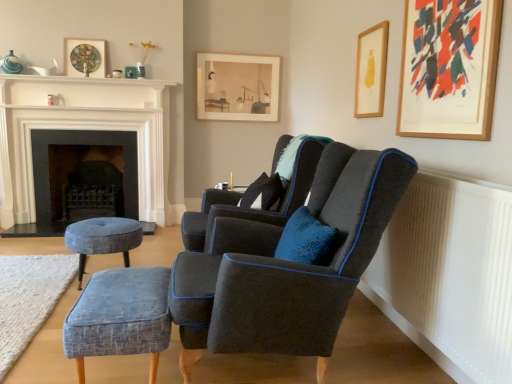
The width and height of the screenshot is (512, 384). I want to click on textured blue ottoman at lower left, so click(29, 298).

Measure the distance between matte glass picture frame at upper left, which is counted as the first picture frame, starting from the left, and camera.

matte glass picture frame at upper left, which is counted as the first picture frame, starting from the left, is 3.98 meters from camera.

You are a GUI agent. You are given a task and a screenshot of the screen. Output one action in this format:
    pyautogui.click(x=<x>, y=<y>)
    Task: Click on the white glossy fireplace at upper left, the first fireplace positioned from the front
    
    Given the screenshot: What is the action you would take?
    pyautogui.click(x=85, y=129)

Image resolution: width=512 pixels, height=384 pixels. Find the location of `textured blue ottoman at lower left`. textured blue ottoman at lower left is located at coordinates (29, 298).

From the image's perspective, which one is positioned lower, textured blue ottoman at lower left or velvet dark blue armchair at center, the first chair positioned from the back?

textured blue ottoman at lower left, from the image's perspective.

From a real-world perspective, is textured blue ottoman at lower left below velvet dark blue armchair at center, the first chair positioned from the back?

Yes.

Does textured blue ottoman at lower left appear on the left side of velvet dark blue armchair at center, the first chair positioned from the back?

Yes, textured blue ottoman at lower left is to the left of velvet dark blue armchair at center, the first chair positioned from the back.

From a real-world perspective, is matte glass picture frame at upper left, the third picture frame when ordered from front to back, below velvet blue stool at lower left, arranged as the 2th stool when viewed from the right?

Incorrect, from a real-world perspective, matte glass picture frame at upper left, the third picture frame when ordered from front to back, is higher than velvet blue stool at lower left, arranged as the 2th stool when viewed from the right.

Based on the photo, does matte glass picture frame at upper left, the fourth picture frame viewed from the right, have a larger size compared to velvet blue stool at lower left, marked as the first stool in a back-to-front arrangement?

No.

In the scene shown: Is matte glass picture frame at upper left, which is counted as the first picture frame, starting from the left, with velvet blue stool at lower left, arranged as the 2th stool when viewed from the right?

matte glass picture frame at upper left, which is counted as the first picture frame, starting from the left, and velvet blue stool at lower left, arranged as the 2th stool when viewed from the right, are clearly separated.

Is the position of matte glass picture frame at upper left, the fourth picture frame viewed from the right, more distant than that of velvet blue stool at lower left, which ranks as the 2th stool in front-to-back order?

Yes, matte glass picture frame at upper left, the fourth picture frame viewed from the right, is further from the camera.

Are dark gray stone fireplace at left, placed as the 1th fireplace when sorted from back to front, and wooden picture frame at upper right, placed as the 3th picture frame when sorted from back to front, far apart?

That's right, there is a large distance between dark gray stone fireplace at left, placed as the 1th fireplace when sorted from back to front, and wooden picture frame at upper right, placed as the 3th picture frame when sorted from back to front.

Considering the points (67, 135) and (381, 27), which point is in front, point (67, 135) or point (381, 27)?

The point (381, 27) is closer to the camera.

From a real-world perspective, is dark gray stone fireplace at left, placed as the 1th fireplace when sorted from back to front, positioned above or below wooden picture frame at upper right, the 2th picture frame from the right?

In terms of real-world spatial position, dark gray stone fireplace at left, placed as the 1th fireplace when sorted from back to front, is below wooden picture frame at upper right, the 2th picture frame from the right.

Is dark gray stone fireplace at left, the 2th fireplace when ordered from front to back, wider than wooden picture frame at upper right, placed as the 3th picture frame when sorted from back to front?

Yes, dark gray stone fireplace at left, the 2th fireplace when ordered from front to back, is wider than wooden picture frame at upper right, placed as the 3th picture frame when sorted from back to front.

Are velvet dark blue armchair at center, the first chair positioned from the back, and matte glass picture frame at upper left, which is counted as the first picture frame, starting from the left, far apart?

That's right, there is a large distance between velvet dark blue armchair at center, the first chair positioned from the back, and matte glass picture frame at upper left, which is counted as the first picture frame, starting from the left.

From a real-world perspective, which object rests below the other?

From a 3D spatial view, velvet dark blue armchair at center, the first chair positioned from the back, is below.

Is velvet dark blue armchair at center, the first chair positioned from the back, behind matte glass picture frame at upper left, acting as the second picture frame starting from the back?

No, velvet dark blue armchair at center, the first chair positioned from the back, is closer to the viewer.

Is velvet dark blue armchair at center, the first chair positioned from the back, completely or partially outside of matte glass picture frame at upper left, the third picture frame when ordered from front to back?

Yes, velvet dark blue armchair at center, the first chair positioned from the back, is not within matte glass picture frame at upper left, the third picture frame when ordered from front to back.

Is wooden framed artwork at upper right, positioned as the first picture frame in front-to-back order, completely or partially outside of dark blue fabric chair at right, the second chair in the back-to-front sequence?

Yes.

Consider the image. Can you confirm if wooden framed artwork at upper right, positioned as the first picture frame in front-to-back order, is positioned to the right of dark blue fabric chair at right, the second chair in the back-to-front sequence?

Correct, you'll find wooden framed artwork at upper right, positioned as the first picture frame in front-to-back order, to the right of dark blue fabric chair at right, the second chair in the back-to-front sequence.

From a real-world perspective, is wooden framed artwork at upper right, positioned as the first picture frame in front-to-back order, below dark blue fabric chair at right, the second chair in the back-to-front sequence?

No.

Does wooden framed artwork at upper right, the 4th picture frame positioned from the back, lie behind dark blue fabric chair at right, the first chair when ordered from front to back?

Yes, it is behind dark blue fabric chair at right, the first chair when ordered from front to back.

Where is `picture frame that is the 1st one when counting forward from the matte glass picture frame at upper left, the third picture frame when ordered from front to back`? picture frame that is the 1st one when counting forward from the matte glass picture frame at upper left, the third picture frame when ordered from front to back is located at coordinates (371, 71).

Which of these two, wooden picture frame at upper right, which ranks as the second picture frame in front-to-back order, or matte glass picture frame at upper left, the fourth picture frame viewed from the right, stands taller?

Standing taller between the two is wooden picture frame at upper right, which ranks as the second picture frame in front-to-back order.

Considering the positions of points (373, 97) and (101, 74), is point (373, 97) closer to camera compared to point (101, 74)?

Yes, it is.

Can we say wooden picture frame at upper right, placed as the 3th picture frame when sorted from back to front, lies outside matte glass picture frame at upper left, the fourth picture frame viewed from the right?

Absolutely, wooden picture frame at upper right, placed as the 3th picture frame when sorted from back to front, is external to matte glass picture frame at upper left, the fourth picture frame viewed from the right.

Does velvet blue stool at lower left, which ranks as the 2th stool in front-to-back order, turn towards textured blue fabric stool at lower left, the first stool viewed from the front?

No, velvet blue stool at lower left, which ranks as the 2th stool in front-to-back order, is not oriented towards textured blue fabric stool at lower left, the first stool viewed from the front.

From a real-world perspective, between velvet blue stool at lower left, marked as the first stool in a back-to-front arrangement, and textured blue fabric stool at lower left, acting as the first stool starting from the right, who is vertically higher?

From a 3D spatial view, velvet blue stool at lower left, marked as the first stool in a back-to-front arrangement, is above.

Find the location of a particular element. The width and height of the screenshot is (512, 384). stool above the textured blue fabric stool at lower left, positioned as the second stool in left-to-right order (from the image's perspective) is located at coordinates (102, 239).

Where is `plain on the left side of velvet dark blue armchair at center, which is the 2th chair in front-to-back order`? Image resolution: width=512 pixels, height=384 pixels. plain on the left side of velvet dark blue armchair at center, which is the 2th chair in front-to-back order is located at coordinates (29, 298).

From the velvet blue stool at lower left, arranged as the 2th stool when viewed from the right, count 1st picture frames backward and point to it. Please provide its 2D coordinates.

[(84, 57)]

Estimate the real-world distances between objects in this image. Which object is closer to wooden picture frame at upper right, the 2th picture frame from the right, textured blue ottoman at lower left or textured blue fabric stool at lower left, positioned as the second stool in left-to-right order?

textured blue fabric stool at lower left, positioned as the second stool in left-to-right order.

From the image, which object appears to be nearer to matte glass picture frame at upper left, acting as the second picture frame starting from the back, velvet blue stool at lower left, arranged as the 2th stool when viewed from the right, or dark gray stone fireplace at left, the 2th fireplace when ordered from front to back?

dark gray stone fireplace at left, the 2th fireplace when ordered from front to back, lies closer to matte glass picture frame at upper left, acting as the second picture frame starting from the back, than the other object.

From the image, which object appears to be nearer to white glossy fireplace at upper left, the first fireplace positioned from the front, wooden framed artwork at upper right, the 4th picture frame positioned from the back, or white ribbed radiator at lower right?

wooden framed artwork at upper right, the 4th picture frame positioned from the back, is closer to white glossy fireplace at upper left, the first fireplace positioned from the front.

Estimate the real-world distances between objects in this image. Which object is further from matte glass picture frame at upper left, the fourth picture frame viewed from the right, matte paper picture frame at upper center, which appears as the 1th picture frame when viewed from the back, or textured blue ottoman at lower left?

Among the two, textured blue ottoman at lower left is located further to matte glass picture frame at upper left, the fourth picture frame viewed from the right.

Looking at the image, which one is located closer to velvet blue stool at lower left, positioned as the 1th stool in left-to-right order, white glossy fireplace at upper left, acting as the second fireplace starting from the back, or textured blue ottoman at lower left?

Based on the image, textured blue ottoman at lower left appears to be nearer to velvet blue stool at lower left, positioned as the 1th stool in left-to-right order.

Which object lies further to the anchor point white ribbed radiator at lower right, velvet blue stool at lower left, positioned as the 1th stool in left-to-right order, or textured blue ottoman at lower left?

textured blue ottoman at lower left lies further to white ribbed radiator at lower right than the other object.

Estimate the real-world distances between objects in this image. Which object is closer to velvet blue stool at lower left, marked as the first stool in a back-to-front arrangement, white glossy fireplace at upper left, acting as the second fireplace starting from the back, or dark blue fabric chair at right, the first chair when ordered from front to back?

Among the two, dark blue fabric chair at right, the first chair when ordered from front to back, is located nearer to velvet blue stool at lower left, marked as the first stool in a back-to-front arrangement.

From the image, which object appears to be nearer to velvet dark blue armchair at center, the first chair positioned from the back, wooden picture frame at upper right, placed as the 3th picture frame when sorted from back to front, or textured blue ottoman at lower left?

wooden picture frame at upper right, placed as the 3th picture frame when sorted from back to front, is closer to velvet dark blue armchair at center, the first chair positioned from the back.

Where is `radiator between velvet blue stool at lower left, arranged as the 2th stool when viewed from the right, and wooden framed artwork at upper right, marked as the 4th picture frame in a left-to-right arrangement, from left to right`? The width and height of the screenshot is (512, 384). radiator between velvet blue stool at lower left, arranged as the 2th stool when viewed from the right, and wooden framed artwork at upper right, marked as the 4th picture frame in a left-to-right arrangement, from left to right is located at coordinates (450, 275).

I want to click on picture frame between dark blue fabric chair at right, the first chair when ordered from front to back, and wooden picture frame at upper right, the 2th picture frame from the right, along the z-axis, so click(449, 68).

The width and height of the screenshot is (512, 384). Find the location of `chair between dark blue fabric chair at right, the second chair in the back-to-front sequence, and wooden picture frame at upper right, the 2th picture frame from the right, along the z-axis`. chair between dark blue fabric chair at right, the second chair in the back-to-front sequence, and wooden picture frame at upper right, the 2th picture frame from the right, along the z-axis is located at coordinates [253, 209].

Where is `plain between wooden framed artwork at upper right, the 4th picture frame positioned from the back, and dark gray stone fireplace at left, the 2th fireplace when ordered from front to back, along the z-axis`? Image resolution: width=512 pixels, height=384 pixels. plain between wooden framed artwork at upper right, the 4th picture frame positioned from the back, and dark gray stone fireplace at left, the 2th fireplace when ordered from front to back, along the z-axis is located at coordinates (29, 298).